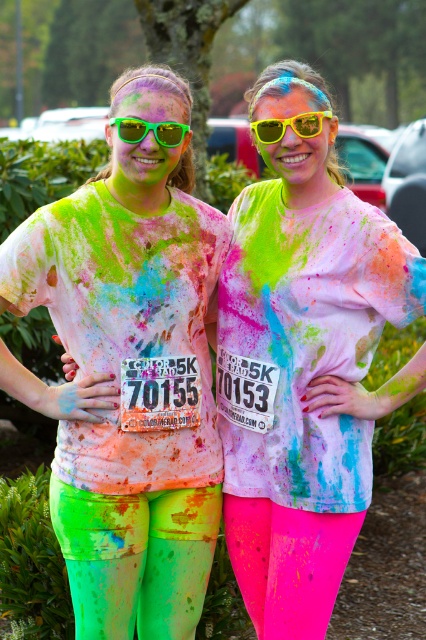
Based on the photo, you are a photographer at the Color Run event. You want to capture a photo where the neon green fabric shirt at center is clearly visible to the left of the yellow matte sunglasses at center. Based on the scene description, can you position yourself to achieve this composition?

Yes, the neon green fabric shirt at center is positioned on the left side of yellow matte sunglasses at center, so positioning yourself to the right of the subjects will allow you to frame the neon green fabric shirt at center to the left of the yellow matte sunglasses at center.

You are a photographer at the Color Run event. You need to capture a photo where the neon pink leggings at center and yellow matte sunglasses at center are both visible. Based on their positions, which object should appear higher in the photo?

The yellow matte sunglasses at center should appear higher in the photo because the neon pink leggings at center is located below yellow matte sunglasses at center.

You are a photographer trying to capture a closeup of the neon green fabric shirt at center and the yellow matte sunglasses at center. Which object should you zoom in on first to ensure it fits entirely within your camera frame?

The neon green fabric shirt at center has a larger width compared to the yellow matte sunglasses at center, so you should zoom in on the neon green fabric shirt at center first to ensure it fits entirely within your camera frame.